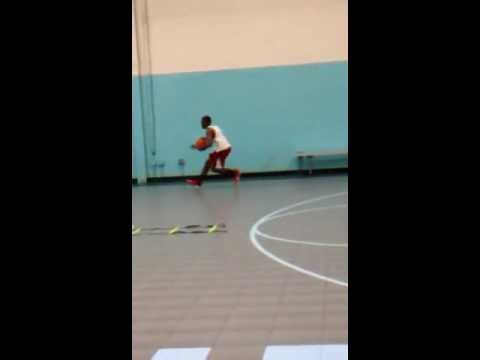
The height and width of the screenshot is (360, 480). Identify the location of wall. (257, 104), (224, 47).